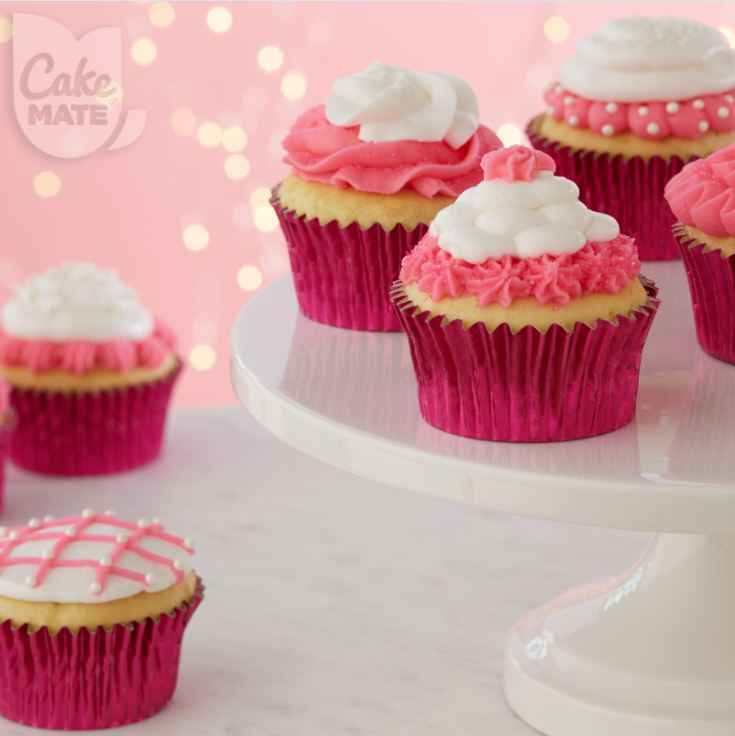
Find the location of a particular element. This screenshot has height=736, width=735. marble is located at coordinates (359, 541).